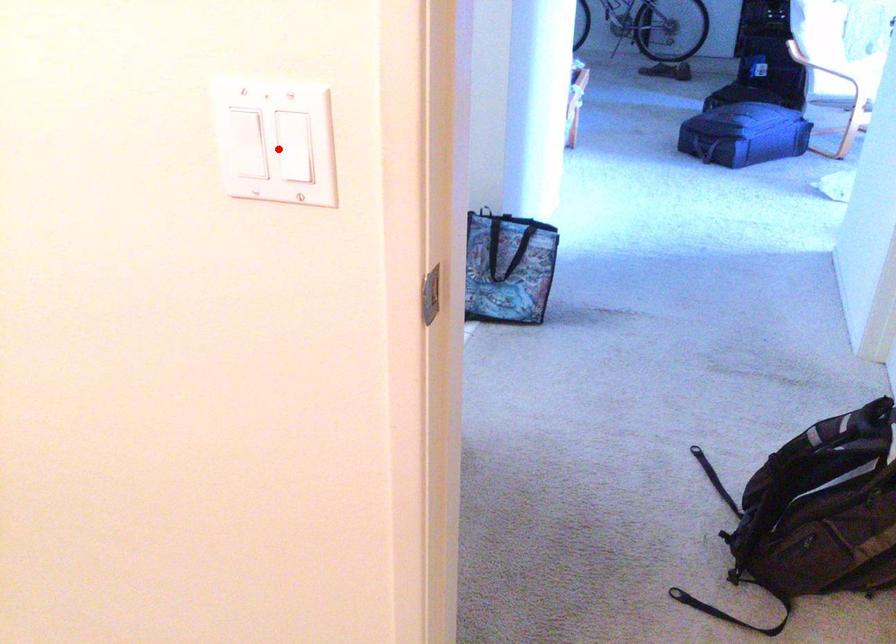
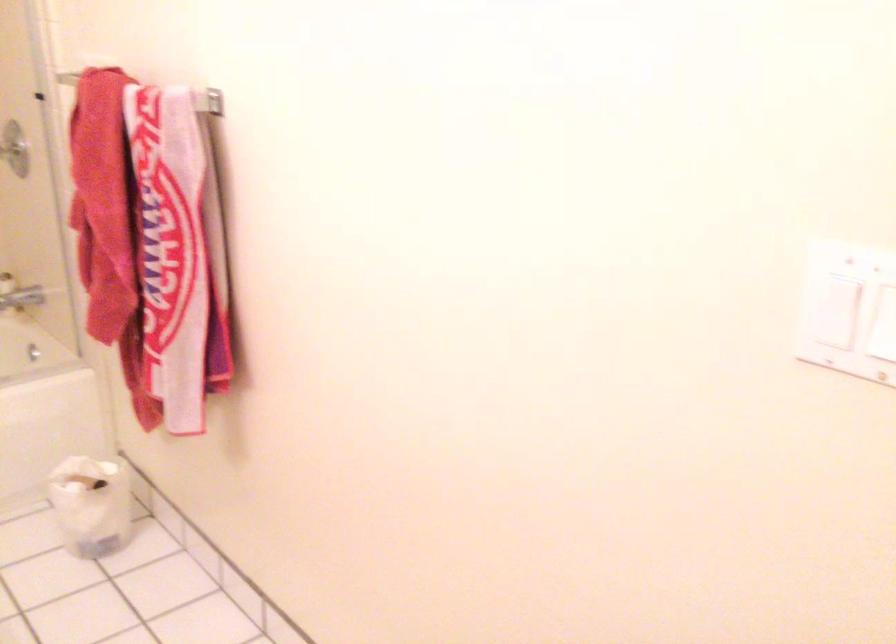
Locate, in the second image, the point that corresponds to the highlighted location in the first image.

(883, 319)